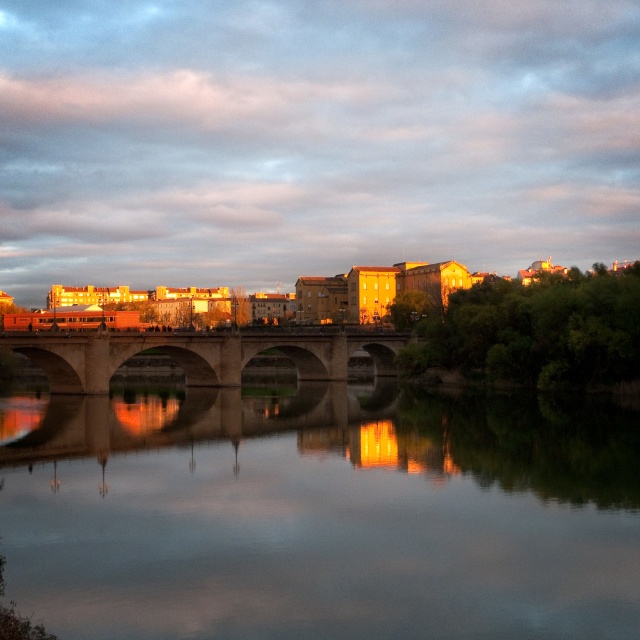
Is smooth reflective water at center above stone bridge at center?

No, smooth reflective water at center is not above stone bridge at center.

I want to click on smooth reflective water at center, so click(323, 513).